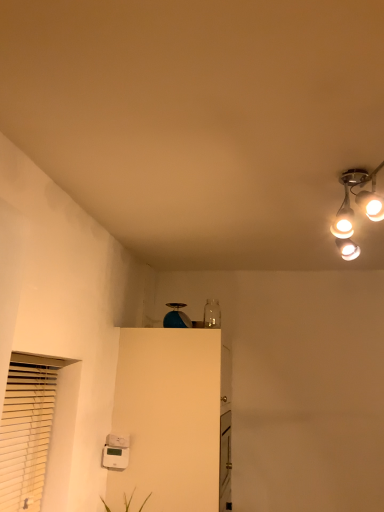
What do you see at coordinates (28, 428) in the screenshot? I see `white wood blinds at lower left` at bounding box center [28, 428].

The height and width of the screenshot is (512, 384). I want to click on white wood blinds at lower left, so click(x=28, y=428).

Locate an element on the screen. The width and height of the screenshot is (384, 512). white wood blinds at lower left is located at coordinates coord(28,428).